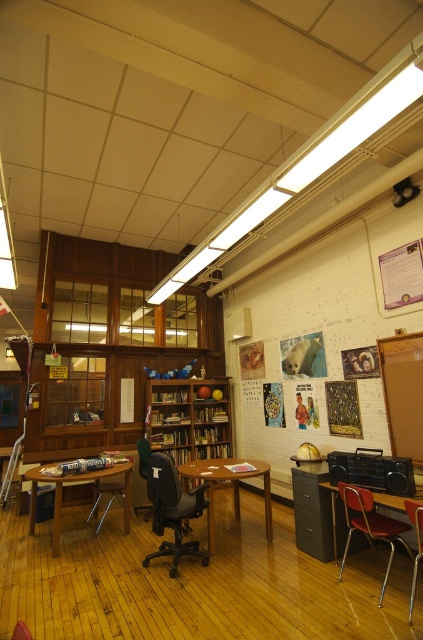
Question: Which is farther from the green fabric office chair at center?

Choices:
 (A) metallic swivel chair at lower right
 (B) metallic at right

Answer: (B)

Question: Which of the following is the farthest from the observer?

Choices:
 (A) 32,488
 (B) 142,452
 (C) 401,346

Answer: (B)

Question: Can you confirm if black mesh swivel chair at center is positioned below metallic swivel chair at lower right?

Choices:
 (A) yes
 (B) no

Answer: (A)

Question: Estimate the real-world distances between objects in this image. Which object is farther from the brown cardboard at right?

Choices:
 (A) brown wooden table at center
 (B) black mesh swivel chair at center

Answer: (B)

Question: Does wooden table at lower left have a larger size compared to metallic at right?

Choices:
 (A) no
 (B) yes

Answer: (B)

Question: Can you confirm if brown wooden table at center is thinner than metallic swivel chair at lower right?

Choices:
 (A) no
 (B) yes

Answer: (A)